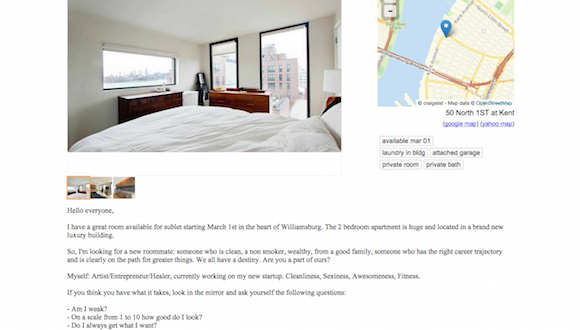
Where is `bed`? bed is located at coordinates 77,196, 162,132.